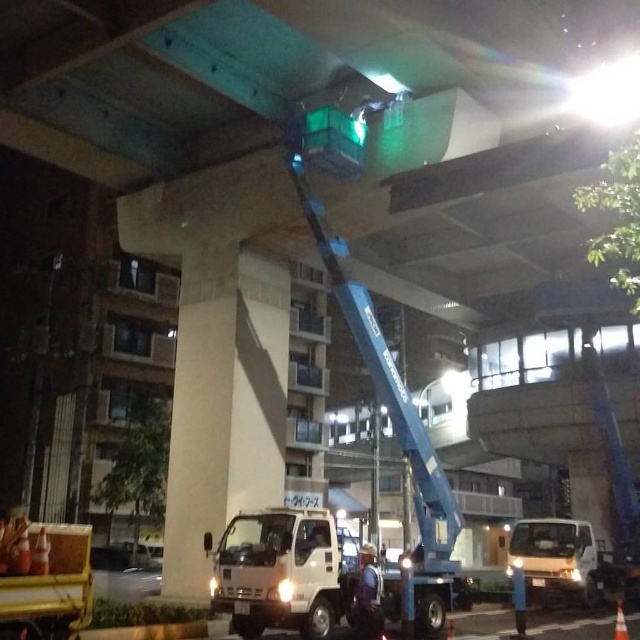
What do you see at coordinates (554, 557) in the screenshot?
I see `white matte truck at lower right` at bounding box center [554, 557].

Does point (561, 552) come closer to viewer compared to point (358, 605)?

That is False.

Is point (556, 568) more distant than point (358, 630)?

Yes.

You are a GUI agent. You are given a task and a screenshot of the screen. Output one action in this format:
    pyautogui.click(x=<x>, y=<y>)
    Task: Click on the white matte truck at lower right
    Image resolution: width=640 pixels, height=640 pixels.
    Given the screenshot: What is the action you would take?
    pyautogui.click(x=554, y=557)

Does white matte truck at lower center appear under orange reflective cone at lower right?

Actually, white matte truck at lower center is above orange reflective cone at lower right.

Does white matte truck at lower center come in front of orange reflective cone at lower right?

No.

Is point (252, 616) positioned before point (621, 614)?

Yes, point (252, 616) is in front of point (621, 614).

At what (x,y) coordinates should I click in order to perform the action: click on white matte truck at lower center. Please return your answer as a coordinate pair (x, y). Looking at the image, I should click on (282, 572).

Which of these two, white matte truck at lower center or white matte truck at lower right, stands taller?

white matte truck at lower right

Between white matte truck at lower center and white matte truck at lower right, which one appears on the left side from the viewer's perspective?

Positioned to the left is white matte truck at lower center.

Which is behind, point (326, 589) or point (582, 520)?

The point (582, 520) is behind.

This screenshot has height=640, width=640. Identify the location of white matte truck at lower center. (282, 572).